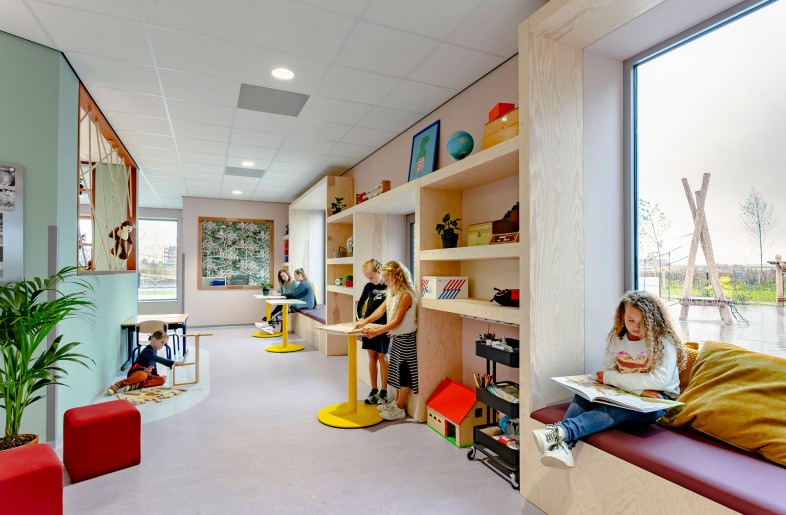
The height and width of the screenshot is (515, 786). What are the coordinates of `table` in the screenshot? It's located at (267, 300).